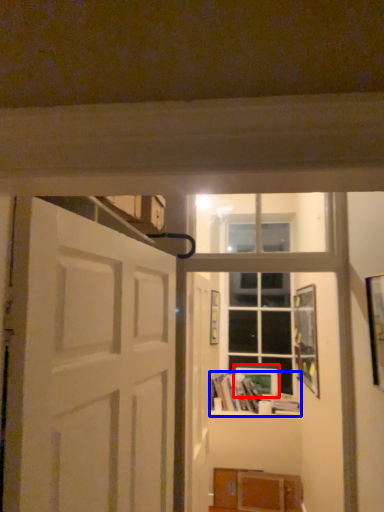
Question: Among these objects, which one is farthest to the camera, picture frame (highlighted by a red box) or book (highlighted by a blue box)?

Choices:
 (A) picture frame
 (B) book

Answer: (A)